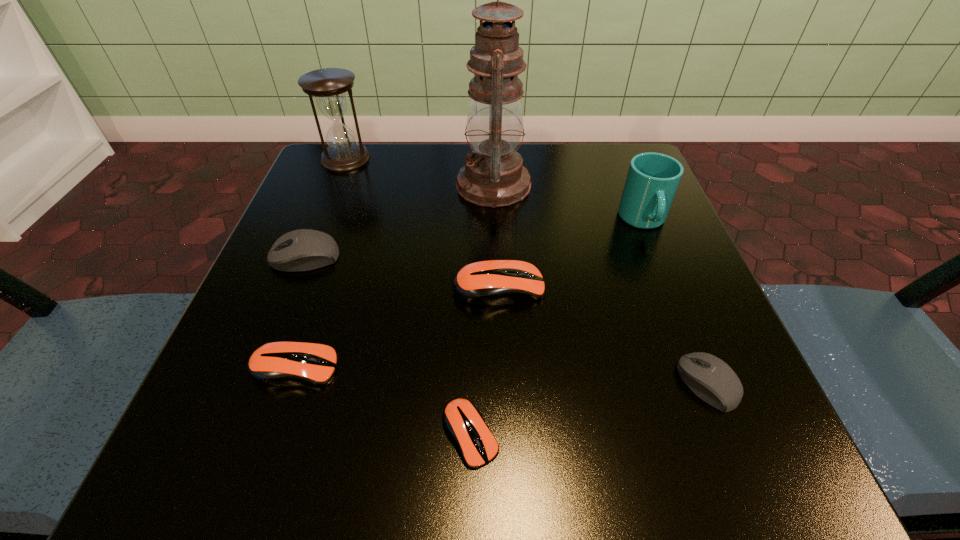
The image size is (960, 540). What are the coordinates of `oil lamp` in the screenshot? It's located at [x=493, y=176].

This screenshot has width=960, height=540. In order to click on hourglass in this screenshot , I will do `click(328, 86)`.

The width and height of the screenshot is (960, 540). I want to click on the third tallest object, so click(653, 178).

The height and width of the screenshot is (540, 960). Identify the location of the farthest orange computer mouse. (486, 283).

This screenshot has width=960, height=540. What are the coordinates of `the bigger black computer equipment` in the screenshot? It's located at (300, 250).

Where is `the left black computer equipment`? The width and height of the screenshot is (960, 540). the left black computer equipment is located at coordinates (300, 250).

I want to click on the second smallest orange computer mouse, so click(x=281, y=363).

You are a GUI agent. You are given a task and a screenshot of the screen. Output one action in this format:
    pyautogui.click(x=<x>, y=<y>)
    Task: Click on the leftmost orange computer mouse
    
    Given the screenshot: What is the action you would take?
    pyautogui.click(x=281, y=363)

At what (x,y) coordinates should I click in order to perform the action: click on the right black computer equipment. Please return your answer as a coordinate pair (x, y). Looking at the image, I should click on (717, 384).

Image resolution: width=960 pixels, height=540 pixels. I want to click on the rightmost computer mouse, so click(717, 384).